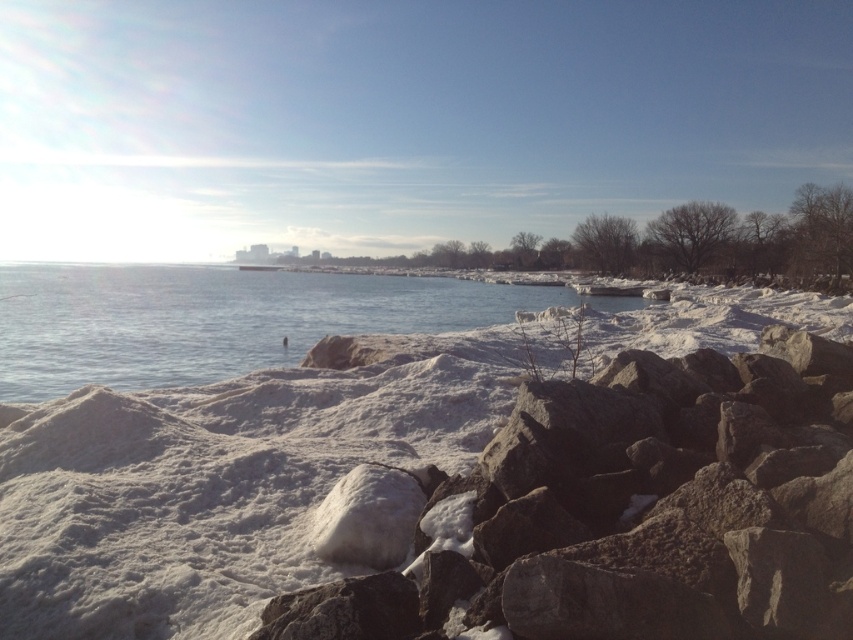
Can you confirm if white fluffy snow at lower left is positioned to the right of clear water at center?

Yes, white fluffy snow at lower left is to the right of clear water at center.

Describe the element at coordinates (454, 490) in the screenshot. I see `white fluffy snow at lower left` at that location.

Identify the location of white fluffy snow at lower left. (454, 490).

Image resolution: width=853 pixels, height=640 pixels. I want to click on white fluffy snow at lower left, so click(454, 490).